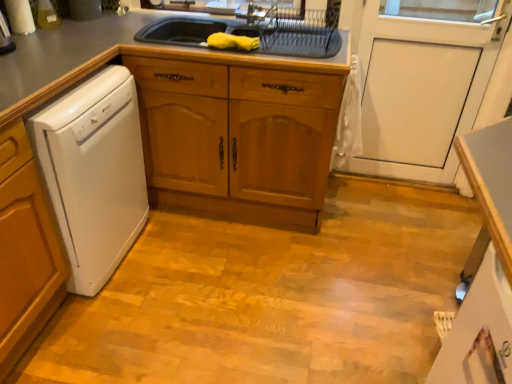
The image size is (512, 384). What do you see at coordinates (94, 173) in the screenshot?
I see `white plastic dishwasher at left` at bounding box center [94, 173].

Looking at this image, measure the distance between point (32, 81) and camera.

Point (32, 81) and camera are 4.92 feet apart.

Image resolution: width=512 pixels, height=384 pixels. What do you see at coordinates (484, 269) in the screenshot?
I see `white glossy counter at lower right` at bounding box center [484, 269].

The image size is (512, 384). In order to click on white matte door at center in this screenshot , I will do pyautogui.click(x=421, y=89).

Image resolution: width=512 pixels, height=384 pixels. Find the location of `white plastic dishwasher at left`. white plastic dishwasher at left is located at coordinates tap(94, 173).

Is white plastic dishwasher at left surrounded by gray matte countertop at upper center?

That's incorrect, white plastic dishwasher at left is not inside gray matte countertop at upper center.

Between gray matte countertop at upper center and white plastic dishwasher at left, which one has larger width?

Wider between the two is white plastic dishwasher at left.

From the image's perspective, between gray matte countertop at upper center and white plastic dishwasher at left, which one is located above?

gray matte countertop at upper center is shown above in the image.

The image size is (512, 384). Find the location of `home appliance below the gray matte countertop at upper center (from the image's perspective)`. home appliance below the gray matte countertop at upper center (from the image's perspective) is located at coordinates (94, 173).

From the image's perspective, is white glossy counter at lower right located beneath metallic silver faucet at upper center?

Yes, from the image's perspective, white glossy counter at lower right is beneath metallic silver faucet at upper center.

Does white glossy counter at lower right have a larger size compared to metallic silver faucet at upper center?

Indeed, white glossy counter at lower right has a larger size compared to metallic silver faucet at upper center.

Considering the relative sizes of white glossy counter at lower right and metallic silver faucet at upper center in the image provided, is white glossy counter at lower right thinner than metallic silver faucet at upper center?

No.

Would you say white glossy counter at lower right contains metallic silver faucet at upper center?

That's incorrect, metallic silver faucet at upper center is not inside white glossy counter at lower right.

Is white glossy counter at lower right next to white matte door at center?

There is a gap between white glossy counter at lower right and white matte door at center.

From a real-world perspective, which object stands above the other?

white matte door at center.

Considering the points (495, 182) and (384, 124), which point is behind, point (495, 182) or point (384, 124)?

The point (384, 124) is farther from the camera.

In the scene shown: Can you confirm if white glossy counter at lower right is bigger than white matte door at center?

Yes, white glossy counter at lower right is bigger than white matte door at center.

Is white plastic dishwasher at left situated inside metallic silver faucet at upper center or outside?

white plastic dishwasher at left is not inside metallic silver faucet at upper center, it's outside.

From a real-world perspective, is white plastic dishwasher at left located beneath metallic silver faucet at upper center?

Yes, from a real-world perspective, white plastic dishwasher at left is beneath metallic silver faucet at upper center.

Who is smaller, white plastic dishwasher at left or metallic silver faucet at upper center?

metallic silver faucet at upper center.

Is white plastic dishwasher at left with metallic silver faucet at upper center?

white plastic dishwasher at left is not next to metallic silver faucet at upper center, and they're not touching.

Does metallic silver faucet at upper center contain white plastic dishwasher at left?

No, white plastic dishwasher at left is not inside metallic silver faucet at upper center.

Is metallic silver faucet at upper center aimed at white plastic dishwasher at left?

No.

Considering the relative sizes of metallic silver faucet at upper center and white plastic dishwasher at left in the image provided, is metallic silver faucet at upper center wider than white plastic dishwasher at left?

No, metallic silver faucet at upper center is not wider than white plastic dishwasher at left.

From a real-world perspective, is white glossy counter at lower right on top of gray matte countertop at upper center?

No.

Can you tell me how much white glossy counter at lower right and gray matte countertop at upper center differ in facing direction?

The angular difference between white glossy counter at lower right and gray matte countertop at upper center is 90.2 degrees.

Locate an element on the screen. counter below the gray matte countertop at upper center (from the image's perspective) is located at coordinates (484, 269).

Can you confirm if white glossy counter at lower right is smaller than gray matte countertop at upper center?

Indeed, white glossy counter at lower right has a smaller size compared to gray matte countertop at upper center.

Would you say gray matte countertop at upper center is inside or outside white matte door at center?

gray matte countertop at upper center is outside white matte door at center.

In the scene shown: Is gray matte countertop at upper center taller or shorter than white matte door at center?

Considering their sizes, gray matte countertop at upper center has less height than white matte door at center.

Is gray matte countertop at upper center facing towards white matte door at center?

No, gray matte countertop at upper center is not aimed at white matte door at center.

Does gray matte countertop at upper center have a larger size compared to white matte door at center?

Yes, gray matte countertop at upper center is bigger than white matte door at center.

Where is `home appliance that is under the gray matte countertop at upper center (from a real-world perspective)`? home appliance that is under the gray matte countertop at upper center (from a real-world perspective) is located at coordinates (94, 173).

Identify the location of counter below the metallic silver faucet at upper center (from the image's perspective). (484, 269).

From the image, which object appears to be farther from white glossy counter at lower right, white plastic dishwasher at left or gray matte countertop at upper center?

Based on the image, white plastic dishwasher at left appears to be further to white glossy counter at lower right.

Estimate the real-world distances between objects in this image. Which object is further from white glossy counter at lower right, gray matte countertop at upper center or white matte door at center?

white matte door at center is positioned further to the anchor white glossy counter at lower right.

When comparing their distances from white matte door at center, does white glossy counter at lower right or metallic silver faucet at upper center seem closer?

metallic silver faucet at upper center is positioned closer to the anchor white matte door at center.

Looking at the image, which one is located further to metallic silver faucet at upper center, white matte door at center or gray matte countertop at upper center?

gray matte countertop at upper center is positioned further to the anchor metallic silver faucet at upper center.

Looking at this image, which object lies nearer to the anchor point metallic silver faucet at upper center, white plastic dishwasher at left or white glossy counter at lower right?

white plastic dishwasher at left is closer to metallic silver faucet at upper center.

Considering their positions, is white matte door at center positioned closer to white plastic dishwasher at left than gray matte countertop at upper center?

Among the two, gray matte countertop at upper center is located nearer to white plastic dishwasher at left.

From the image, which object appears to be nearer to white matte door at center, white plastic dishwasher at left or white glossy counter at lower right?

Among the two, white glossy counter at lower right is located nearer to white matte door at center.

Considering their positions, is gray matte countertop at upper center positioned closer to white glossy counter at lower right than white plastic dishwasher at left?

gray matte countertop at upper center lies closer to white glossy counter at lower right than the other object.

You are a GUI agent. You are given a task and a screenshot of the screen. Output one action in this format:
    pyautogui.click(x=<x>, y=<y>)
    Task: Click on the countertop between white plastic dishwasher at left and white glossy counter at lower right in the horizontal direction
    The width and height of the screenshot is (512, 384).
    Given the screenshot: What is the action you would take?
    pyautogui.click(x=46, y=187)

Where is `faucet between white plastic dishwasher at left and white glossy counter at lower right in the horizontal direction`? faucet between white plastic dishwasher at left and white glossy counter at lower right in the horizontal direction is located at coordinates (261, 14).

What are the coordinates of `countertop between white plastic dishwasher at left and white matte door at center in the horizontal direction` in the screenshot? It's located at (46, 187).

Where is `counter between white plastic dishwasher at left and white matte door at center in the horizontal direction`? The image size is (512, 384). counter between white plastic dishwasher at left and white matte door at center in the horizontal direction is located at coordinates (484, 269).